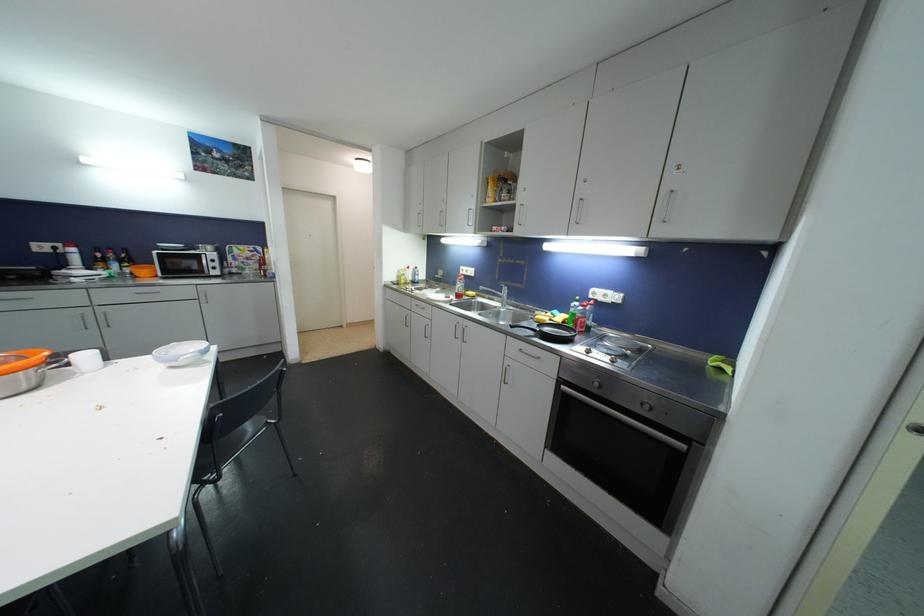
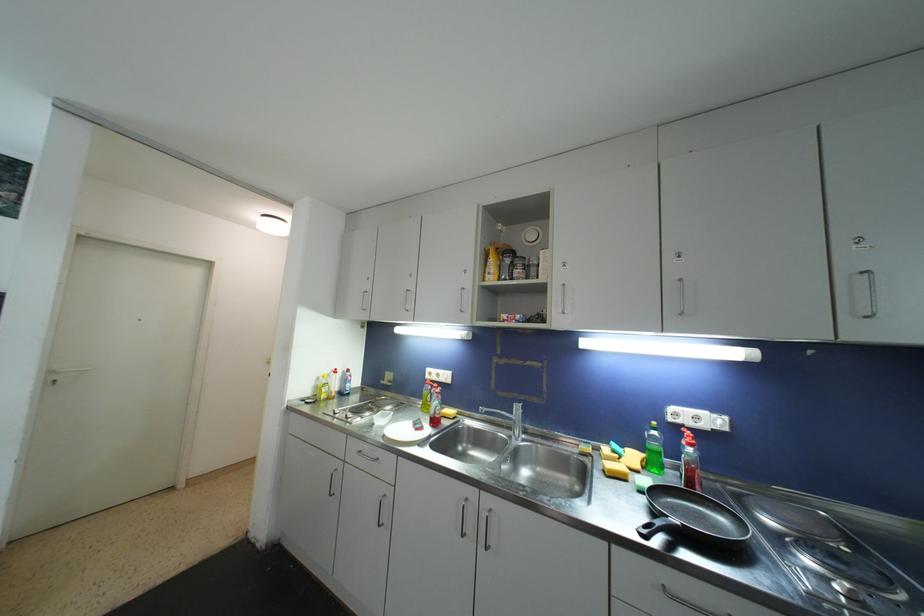
Locate, in the second image, the point that corresponds to point 612,302 in the first image.

(708, 429)